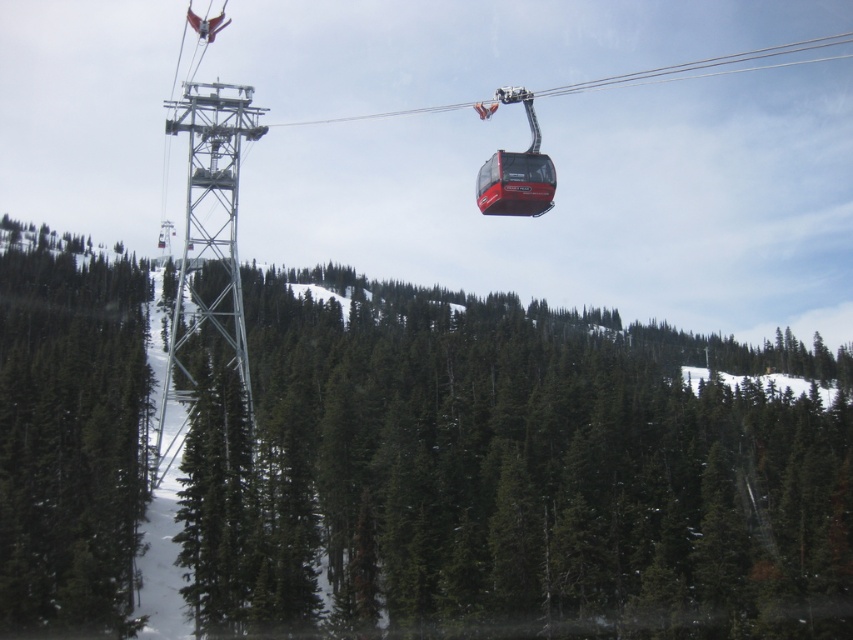
Question: Where is green matte tree at center located in relation to green matte tree at left in the image?

Choices:
 (A) below
 (B) above

Answer: (A)

Question: Considering the relative positions of green matte tree at center and green matte tree at left in the image provided, where is green matte tree at center located with respect to green matte tree at left?

Choices:
 (A) right
 (B) left

Answer: (A)

Question: Does green matte tree at center lie behind green matte tree at left?

Choices:
 (A) yes
 (B) no

Answer: (A)

Question: Which object is closer to the camera taking this photo?

Choices:
 (A) green matte tree at left
 (B) green matte tree at center

Answer: (A)